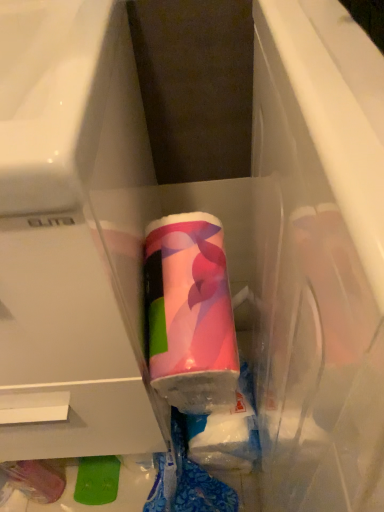
Question: Considering the positions of pink glossy tube at center and matte plastic drawer at center in the image, is pink glossy tube at center wider or thinner than matte plastic drawer at center?

Choices:
 (A) thin
 (B) wide

Answer: (A)

Question: From the image's perspective, is pink glossy tube at center above or below matte plastic drawer at center?

Choices:
 (A) below
 (B) above

Answer: (A)

Question: Do you think pink glossy tube at center is within matte plastic drawer at center, or outside of it?

Choices:
 (A) outside
 (B) inside

Answer: (A)

Question: Is point (125, 411) closer or farther from the camera than point (226, 344)?

Choices:
 (A) farther
 (B) closer

Answer: (A)

Question: In terms of size, does matte plastic drawer at center appear bigger or smaller than pink glossy tube at center?

Choices:
 (A) big
 (B) small

Answer: (A)

Question: From the image's perspective, is matte plastic drawer at center above or below pink glossy tube at center?

Choices:
 (A) above
 (B) below

Answer: (A)

Question: From a real-world perspective, is matte plastic drawer at center physically located above or below pink glossy tube at center?

Choices:
 (A) above
 (B) below

Answer: (A)